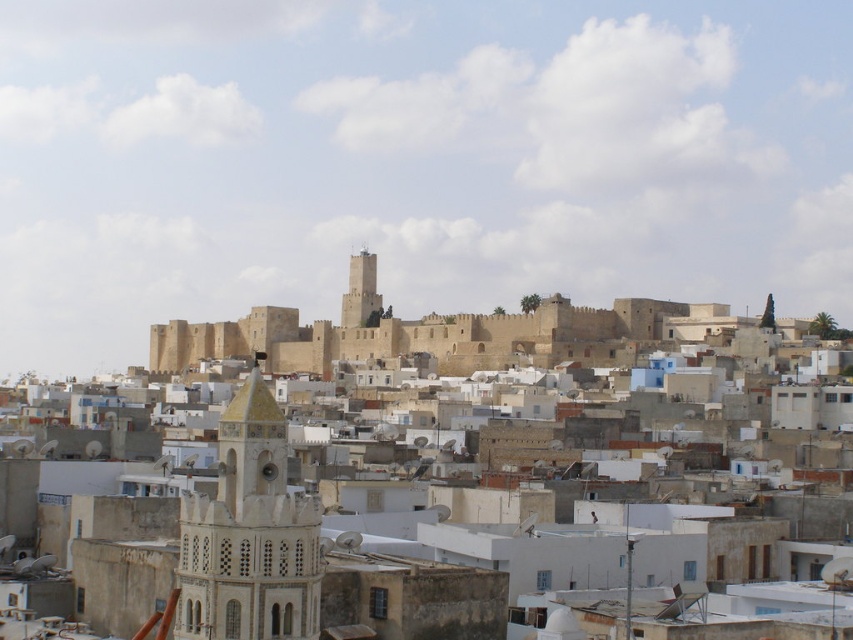
Can you confirm if beige stone town at center is positioned to the left of white stucco tower at center?

In fact, beige stone town at center is to the right of white stucco tower at center.

Can you confirm if beige stone town at center is wider than white stucco tower at center?

Yes, beige stone town at center is wider than white stucco tower at center.

Between point (221, 531) and point (288, 497), which one is positioned in front?

Point (221, 531) is more forward.

Where is `beige stone town at center`? beige stone town at center is located at coordinates (323, 529).

Does beige stone town at center appear on the right side of light brown stone tower at center?

Yes, beige stone town at center is to the right of light brown stone tower at center.

Can you confirm if beige stone town at center is smaller than light brown stone tower at center?

No.

Which is in front, point (590, 541) or point (357, 257)?

Point (590, 541)

At what (x,y) coordinates should I click in order to perform the action: click on beige stone town at center. Please return your answer as a coordinate pair (x, y). The width and height of the screenshot is (853, 640). Looking at the image, I should click on (323, 529).

Is point (215, 608) in front of point (363, 280)?

That is True.

Where is `white stucco tower at center`? This screenshot has width=853, height=640. white stucco tower at center is located at coordinates (248, 534).